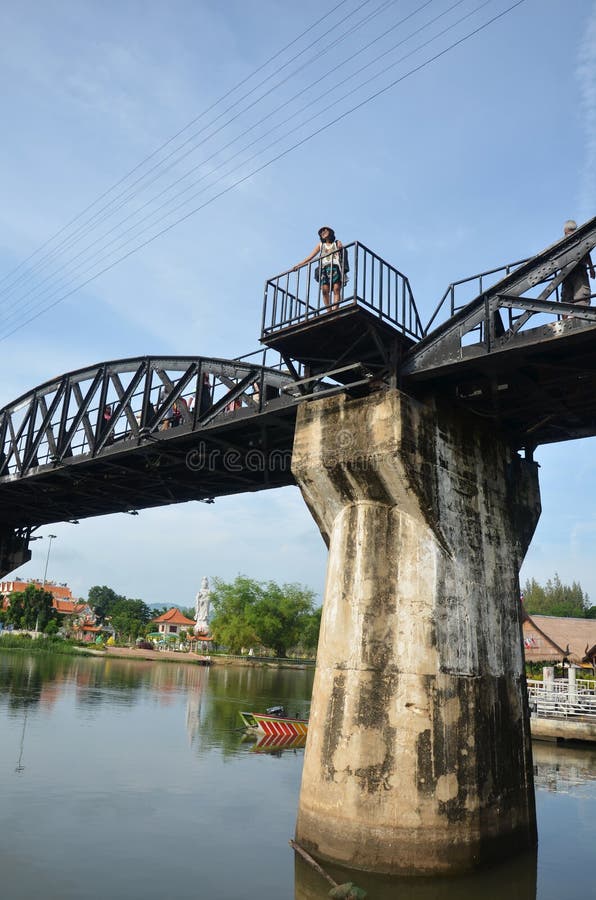
Where is `white statue`? This screenshot has height=900, width=596. white statue is located at coordinates (200, 609).